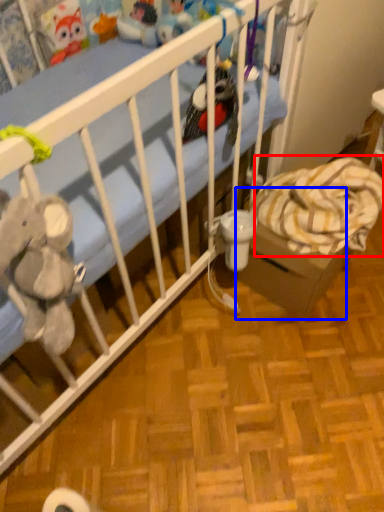
Question: Which object is further to the camera taking this photo, blanket (highlighted by a red box) or cardboard box (highlighted by a blue box)?

Choices:
 (A) blanket
 (B) cardboard box

Answer: (B)